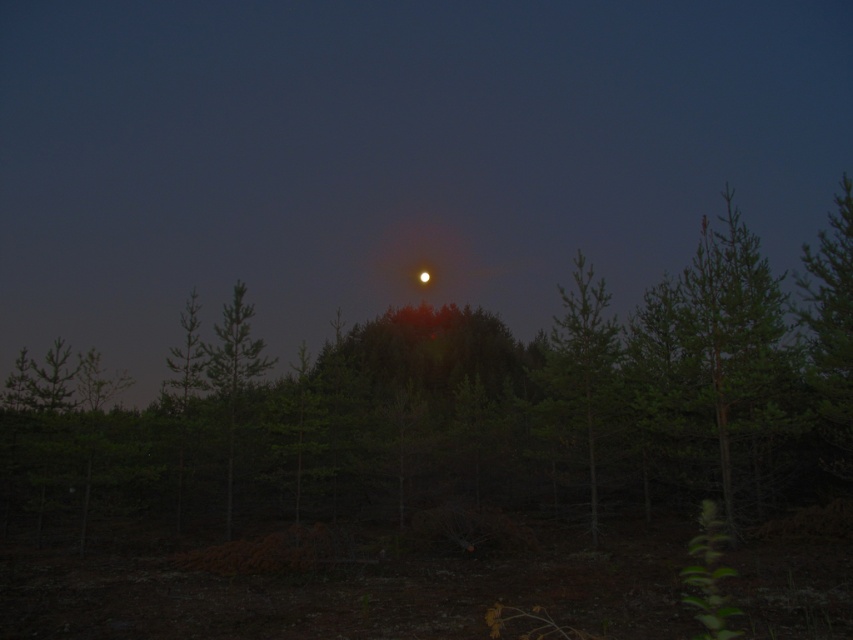
Does bright yellow moon at center appear over green matte tree at left?

Yes, bright yellow moon at center is above green matte tree at left.

Does bright yellow moon at center have a lesser width compared to green matte tree at left?

No.

Between point (224, 170) and point (228, 468), which one is positioned behind?

The point (224, 170) is more distant.

Where is `bright yellow moon at center`? The height and width of the screenshot is (640, 853). bright yellow moon at center is located at coordinates (392, 156).

Does bright yellow moon at center have a greater height compared to green matte tree at right?

Yes, bright yellow moon at center is taller than green matte tree at right.

Between bright yellow moon at center and green matte tree at right, which one has more height?

With more height is bright yellow moon at center.

Between point (636, 182) and point (583, 432), which one is positioned behind?

The point (636, 182) is behind.

The image size is (853, 640). In order to click on bright yellow moon at center in this screenshot , I will do point(392,156).

Is green matte tree at center positioned before green matte tree at left?

That is True.

Describe the element at coordinates (471, 403) in the screenshot. I see `green matte tree at center` at that location.

The width and height of the screenshot is (853, 640). What do you see at coordinates (471, 403) in the screenshot?
I see `green matte tree at center` at bounding box center [471, 403].

The width and height of the screenshot is (853, 640). Identify the location of green matte tree at center. (471, 403).